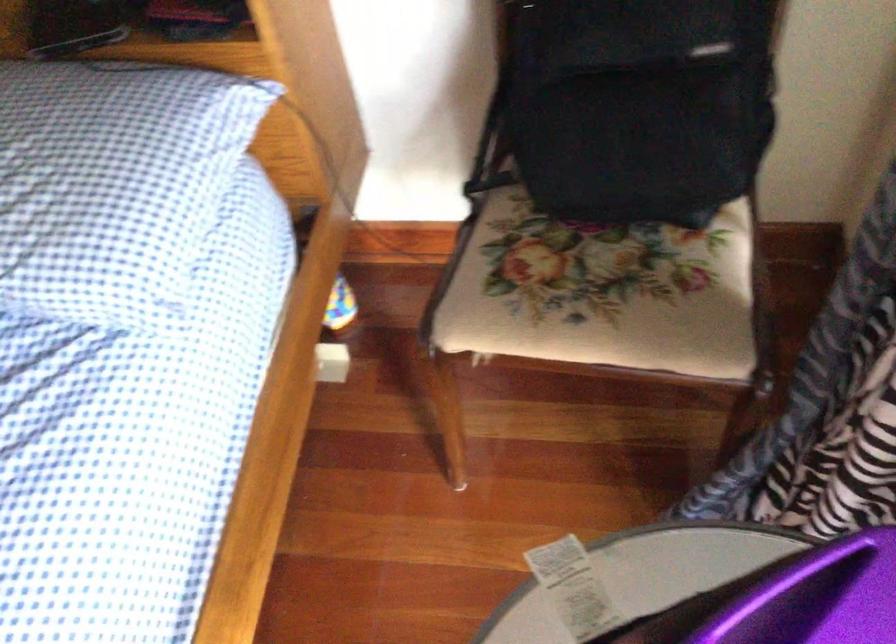
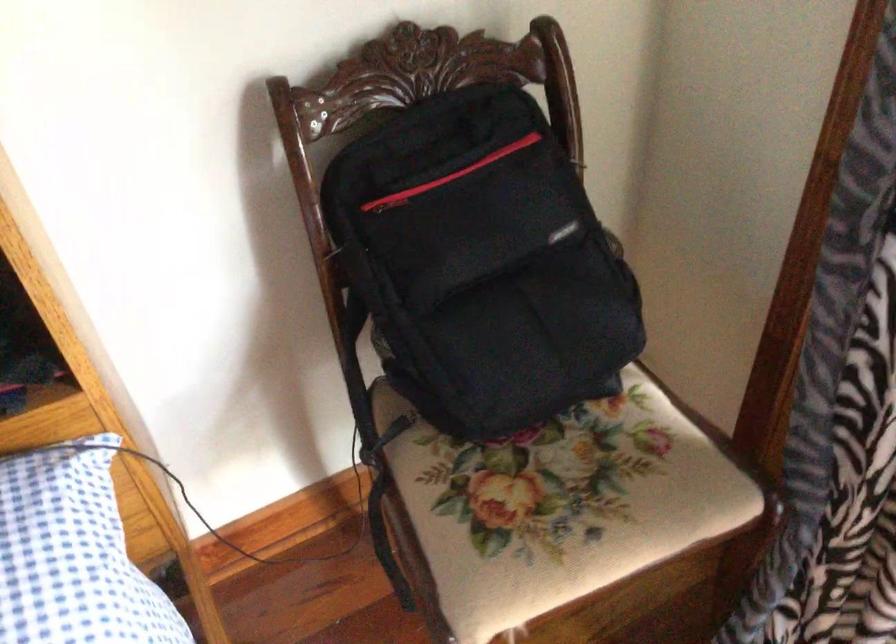
Question: The camera is either moving clockwise (left) or counter-clockwise (right) around the object. The first image is from the beginning of the video and the second image is from the end. Is the camera moving left or right when shooting the video?

Choices:
 (A) Left
 (B) Right

Answer: (A)